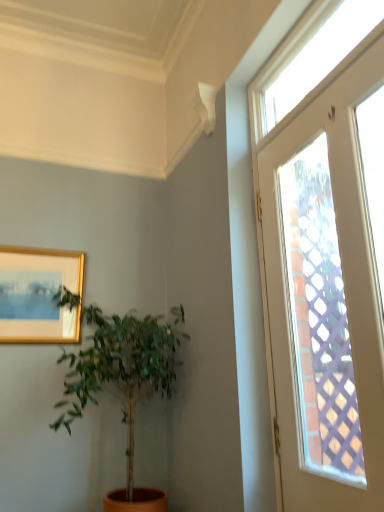
Question: From a real-world perspective, does clear glass door at upper right, the second window positioned from the top, sit lower than green leafy plant at left?

Choices:
 (A) no
 (B) yes

Answer: (A)

Question: Is clear glass door at upper right, the second window positioned from the top, wider than green leafy plant at left?

Choices:
 (A) yes
 (B) no

Answer: (B)

Question: Could you tell me if clear glass door at upper right, acting as the first window starting from the bottom, is facing green leafy plant at left?

Choices:
 (A) no
 (B) yes

Answer: (A)

Question: Does clear glass door at upper right, the second window positioned from the top, have a lesser width compared to green leafy plant at left?

Choices:
 (A) yes
 (B) no

Answer: (A)

Question: Is clear glass door at upper right, acting as the first window starting from the bottom, with green leafy plant at left?

Choices:
 (A) yes
 (B) no

Answer: (B)

Question: From a real-world perspective, is gold-framed picture at upper left above or below clear glass door at upper right, the second window positioned from the top?

Choices:
 (A) above
 (B) below

Answer: (A)

Question: Is point (38, 334) positioned closer to the camera than point (271, 328)?

Choices:
 (A) closer
 (B) farther

Answer: (B)

Question: Looking at their shapes, would you say gold-framed picture at upper left is wider or thinner than clear glass door at upper right, acting as the first window starting from the bottom?

Choices:
 (A) thin
 (B) wide

Answer: (B)

Question: From their relative heights in the image, would you say gold-framed picture at upper left is taller or shorter than clear glass door at upper right, the second window positioned from the top?

Choices:
 (A) tall
 (B) short

Answer: (B)

Question: Would you say clear glass window at upper right, which is the first window in top-to-bottom order, is to the left or to the right of clear glass door at upper right, the second window positioned from the top, in the picture?

Choices:
 (A) right
 (B) left

Answer: (B)

Question: Is clear glass window at upper right, which is the first window in top-to-bottom order, wider or thinner than clear glass door at upper right, the second window positioned from the top?

Choices:
 (A) thin
 (B) wide

Answer: (B)

Question: From their relative heights in the image, would you say clear glass window at upper right, the second window when ordered from bottom to top, is taller or shorter than clear glass door at upper right, the second window positioned from the top?

Choices:
 (A) short
 (B) tall

Answer: (A)

Question: In the image, is clear glass window at upper right, which is the first window in top-to-bottom order, positioned in front of or behind clear glass door at upper right, the second window positioned from the top?

Choices:
 (A) front
 (B) behind

Answer: (B)

Question: Is clear glass door at upper right, the second window positioned from the top, in front of or behind clear glass window at upper right, which is the first window in top-to-bottom order, in the image?

Choices:
 (A) behind
 (B) front

Answer: (B)

Question: Is clear glass door at upper right, the second window positioned from the top, inside or outside of clear glass window at upper right, which is the first window in top-to-bottom order?

Choices:
 (A) inside
 (B) outside

Answer: (B)